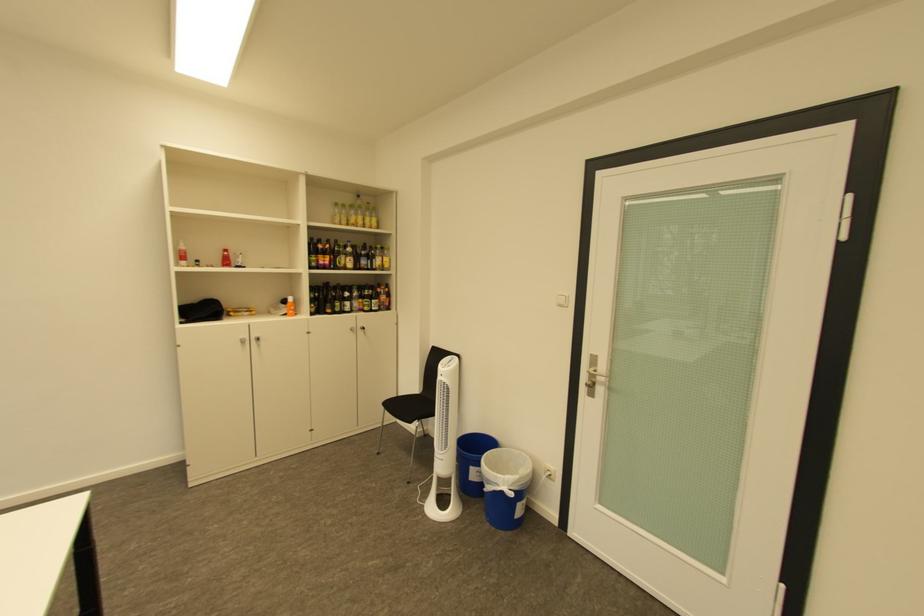
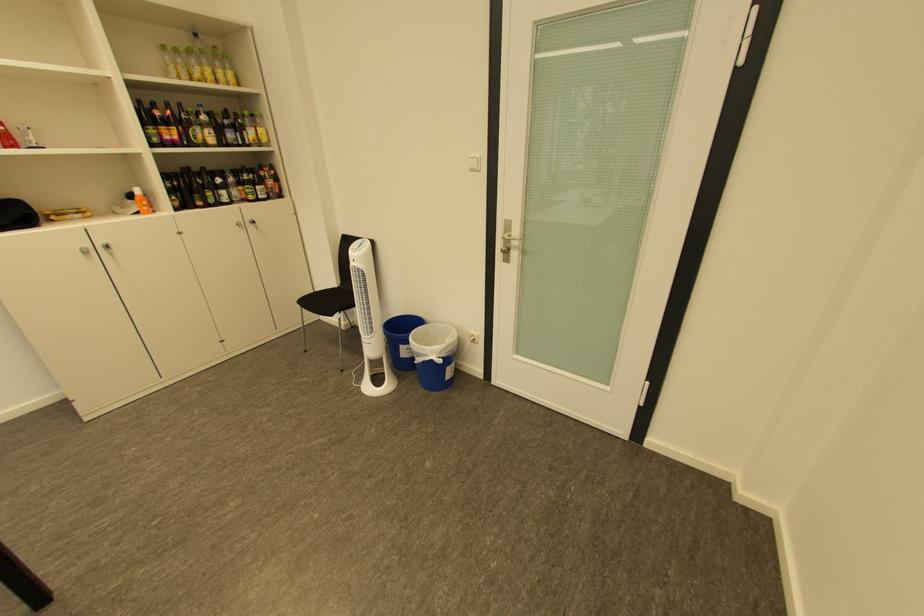
The point at (258, 314) is marked in the first image. Where is the corresponding point in the second image?

(90, 216)